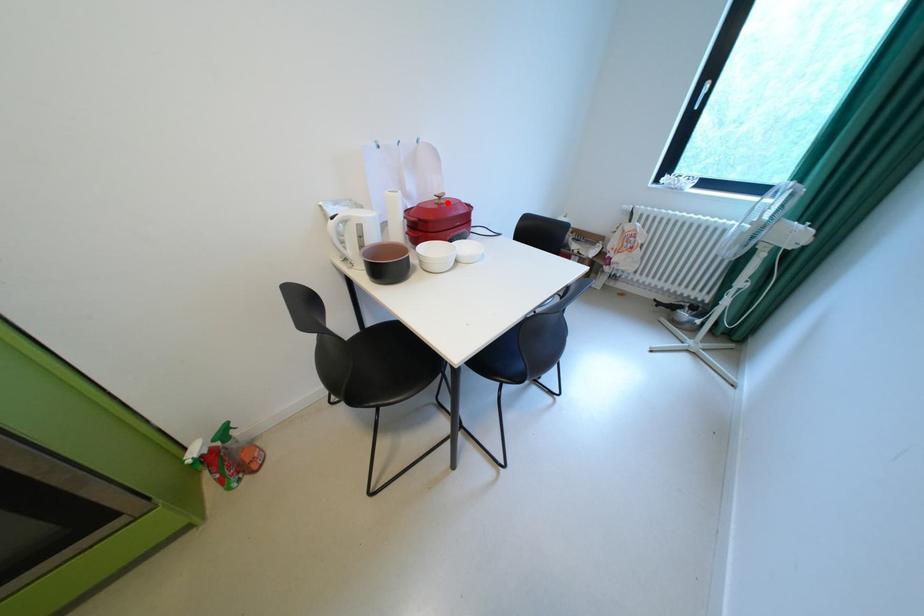
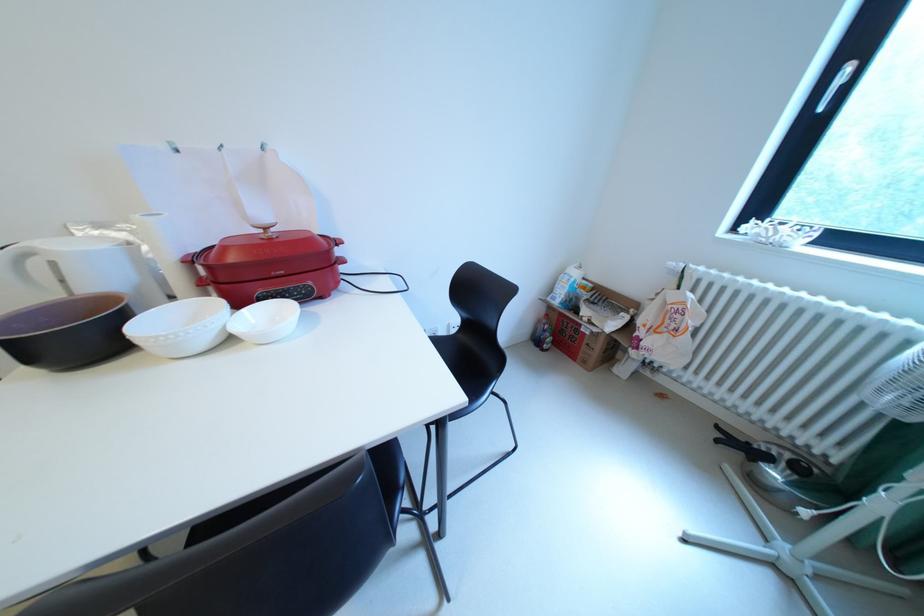
Question: I am providing you with two images of the same scene from different viewpoints. A red point is marked on the first image. At the location where the point appears in image 1, is it still visible in image 2?

Choices:
 (A) Yes
 (B) No

Answer: (A)